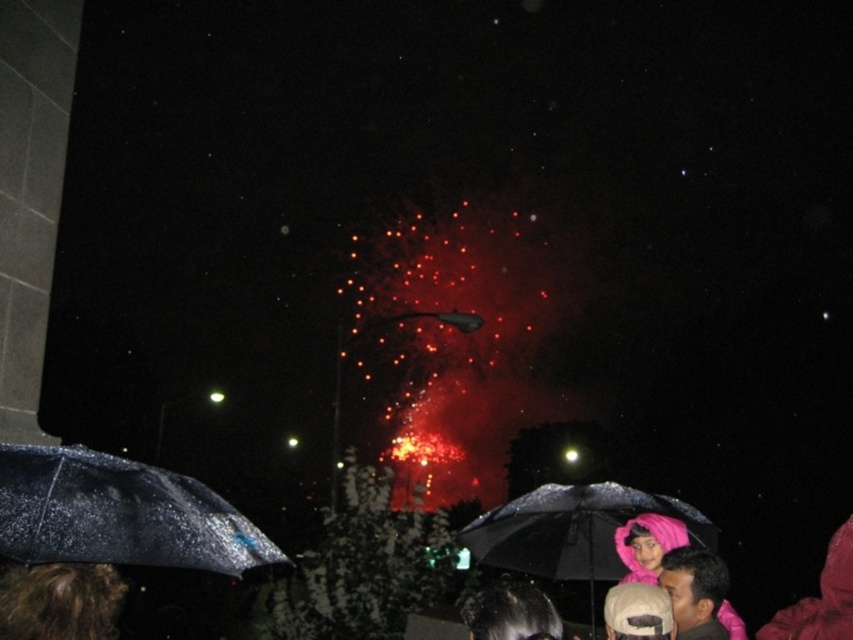
You are a photographer trying to capture the fireworks display. You have a camera with a 12 inch lens. You notice the transparent wet umbrella at lower left and the brown curly hair at lower left in your frame. Can the lens focus on both objects simultaneously?

The transparent wet umbrella at lower left is 12.10 inches from brown curly hair at lower left. Since the distance between them is slightly more than 12 inches, the lens cannot focus on both objects simultaneously.

You are a photographer trying to capture the fireworks display. You notice the transparent wet umbrella at lower left and the brown curly hair at lower left in your frame. Which object should you position closer to the fireworks to ensure the umbrella and hair are both visible in the shot?

You should position the transparent wet umbrella at lower left closer to the fireworks because it is located to the left of brown curly hair at lower left, allowing both objects to be captured within the frame.

You are standing in the crowd watching the fireworks. You need to move from your current position to the black matte umbrella at lower center. Is the transparent wet umbrella at lower left blocking your path?

The transparent wet umbrella at lower left is closer to the viewer than the black matte umbrella at lower center, so it is blocking the path to the black matte umbrella at lower center.